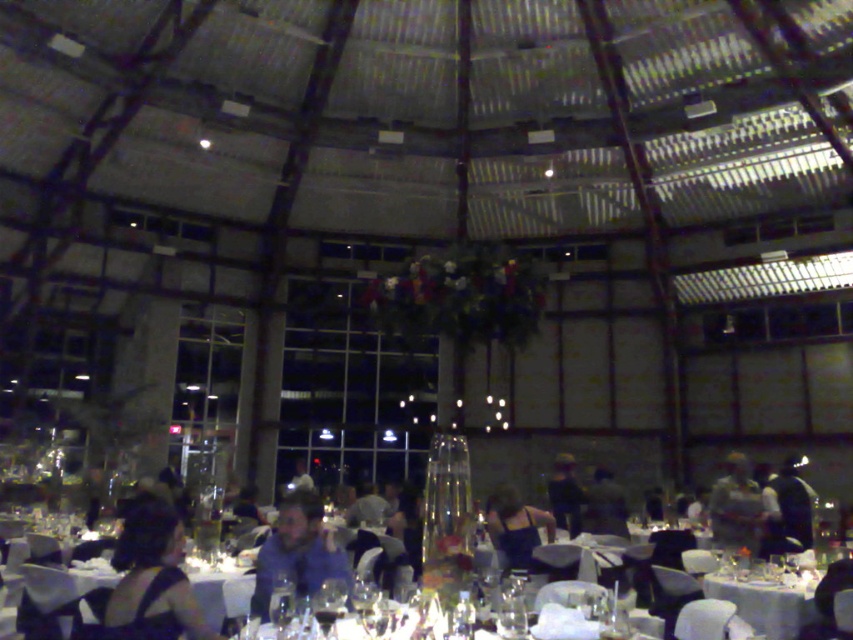
Question: Can you confirm if white glossy table at center is wider than black satin dress at center?

Choices:
 (A) no
 (B) yes

Answer: (B)

Question: Based on their relative distances, which object is nearer to the silvery metallic dress at center?

Choices:
 (A) dark blue fabric jacket at center
 (B) dark blue shirt at center
 (C) black satin dress at lower left
 (D) black satin dress at center

Answer: (B)

Question: Which of the following is the closest to the observer?

Choices:
 (A) (560, 468)
 (B) (746, 518)
 (C) (114, 608)
 (D) (309, 522)

Answer: (C)

Question: Does white glossy table at center appear on the right side of black satin dress at center?

Choices:
 (A) yes
 (B) no

Answer: (A)

Question: In this image, where is black satin dress at lower left located relative to white glossy table at center?

Choices:
 (A) below
 (B) above

Answer: (B)

Question: Which of the following is the farthest from the observer?

Choices:
 (A) blue fabric shirt at center
 (B) black satin dress at lower left

Answer: (A)